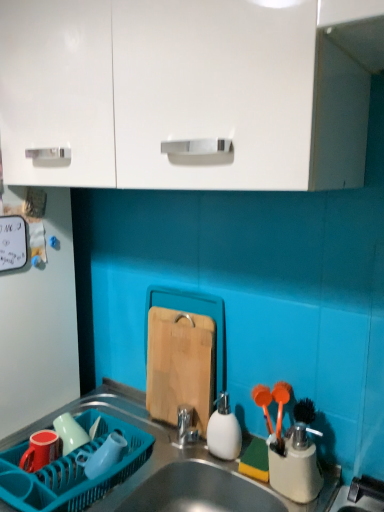
Question: Considering the positions of metallic stainless steel sink at lower center and matte green cup at left, which is the second tableware from left to right, in the image, is metallic stainless steel sink at lower center wider or thinner than matte green cup at left, which is the second tableware from left to right,?

Choices:
 (A) wide
 (B) thin

Answer: (A)

Question: From a real-world perspective, is metallic stainless steel sink at lower center physically located above or below matte green cup at left, which is the second tableware from left to right?

Choices:
 (A) above
 (B) below

Answer: (B)

Question: Which is farther from the white glossy cabinet at upper center?

Choices:
 (A) wooden cutting board at center
 (B) translucent blue plastic cup at lower left, positioned as the third tableware in left-to-right order
 (C) teal plastic dish rack at lower left
 (D) metallic stainless steel sink at lower center
 (E) matte green cup at left, which is the second tableware from left to right

Answer: (E)

Question: Estimate the real-world distances between objects in this image. Which object is closer to the matte green cup at left, which is the third tableware in right-to-left order?

Choices:
 (A) white matte soap dispenser at center, the first tableware when ordered from right to left
 (B) translucent blue plastic cup at lower left, arranged as the 2th tableware when viewed from the right
 (C) wooden cutting board at center
 (D) teal plastic dish rack at lower left
 (E) metallic stainless steel sink at lower center

Answer: (B)